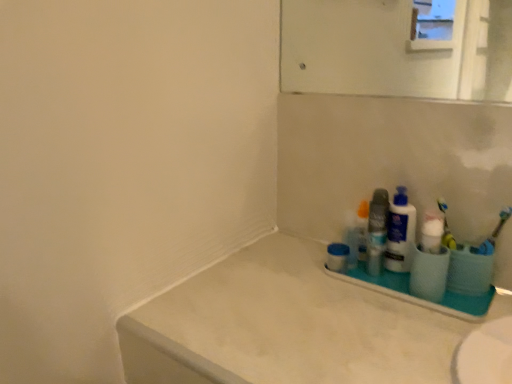
Locate an element on the screen. The image size is (512, 384). vacant point to the left of white plastic tray at lower right is located at coordinates (306, 288).